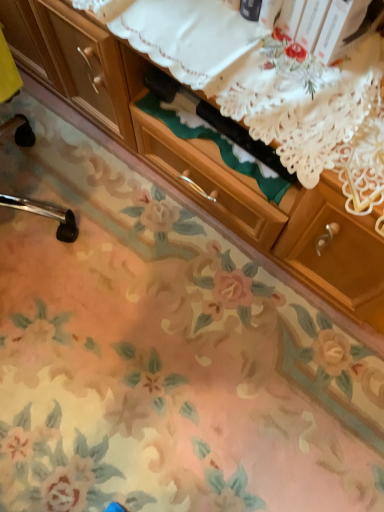
Where is `wooden cabinet at center`? This screenshot has height=512, width=384. wooden cabinet at center is located at coordinates (199, 157).

This screenshot has height=512, width=384. What do you see at coordinates (199, 157) in the screenshot?
I see `wooden cabinet at center` at bounding box center [199, 157].

Image resolution: width=384 pixels, height=512 pixels. Identify the location of wooden cabinet at center. (199, 157).